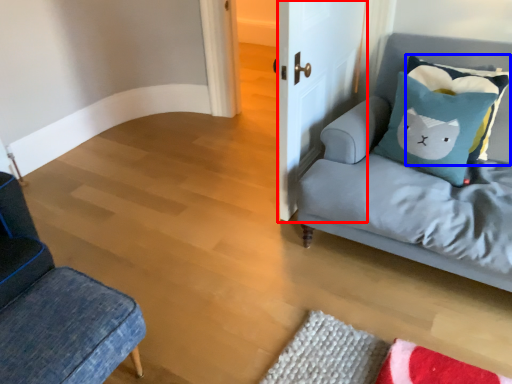
Question: Which of the following is the farthest to the observer, door (highlighted by a red box) or pillow (highlighted by a blue box)?

Choices:
 (A) door
 (B) pillow

Answer: (B)